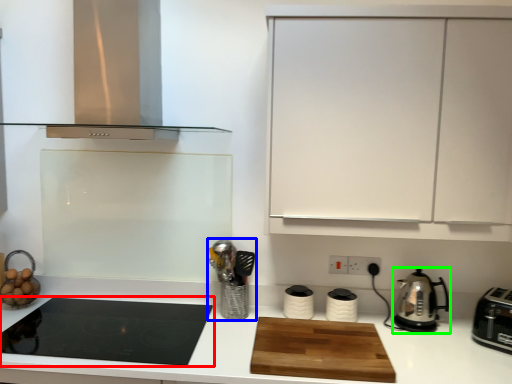
Question: Estimate the real-world distances between objects in this image. Which object is closer to gas stove (highlighted by a red box), appliance (highlighted by a blue box) or kitchen appliance (highlighted by a green box)?

Choices:
 (A) appliance
 (B) kitchen appliance

Answer: (A)